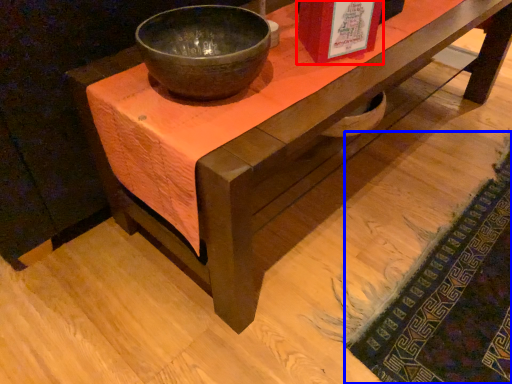
Question: Among these objects, which one is nearest to the camera, book cover (highlighted by a red box) or mat (highlighted by a blue box)?

Choices:
 (A) book cover
 (B) mat

Answer: (B)